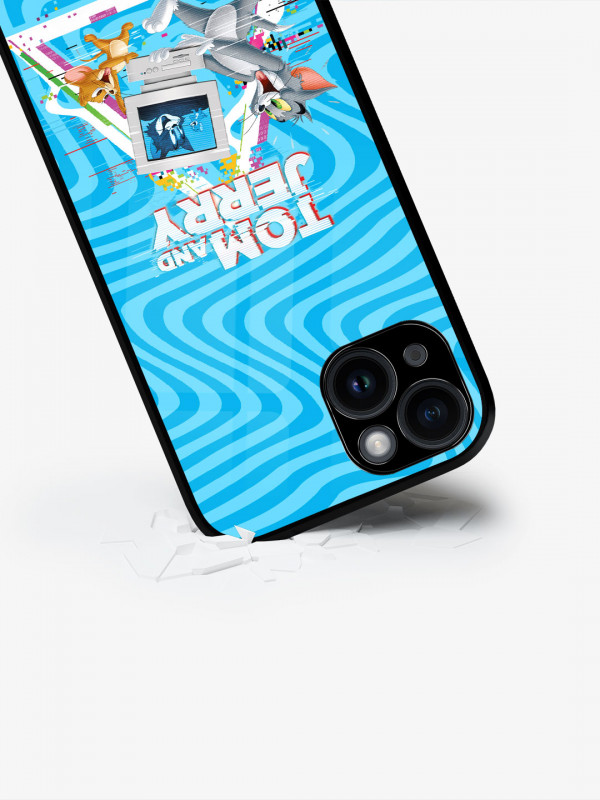
This screenshot has width=600, height=800. What are the coordinates of `mouse` in the screenshot? It's located at (91, 82).